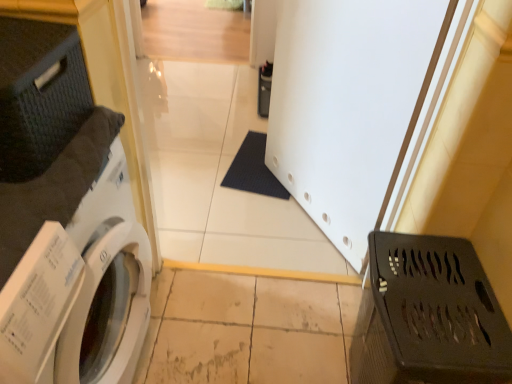
The image size is (512, 384). Find the location of `free space above black plastic laundry basket at lower right (from a real-world perspective)`. free space above black plastic laundry basket at lower right (from a real-world perspective) is located at coordinates (454, 294).